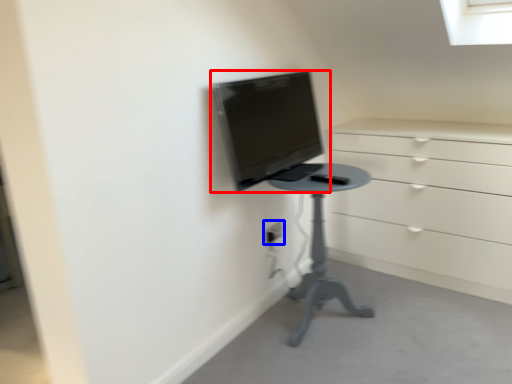
Question: Which point is further to the camera, computer monitor (highlighted by a red box) or electric outlet (highlighted by a blue box)?

Choices:
 (A) computer monitor
 (B) electric outlet

Answer: (B)